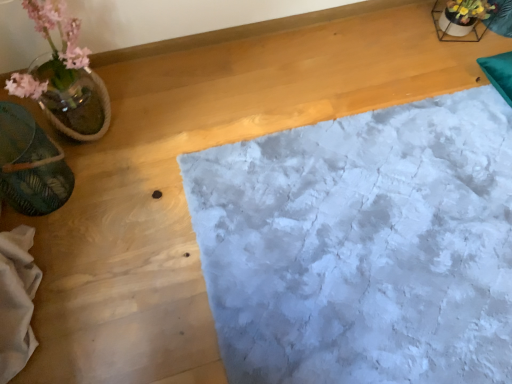
The height and width of the screenshot is (384, 512). In order to click on vacant area that lies in front of translucent glass vase at left in this screenshot , I will do `click(93, 216)`.